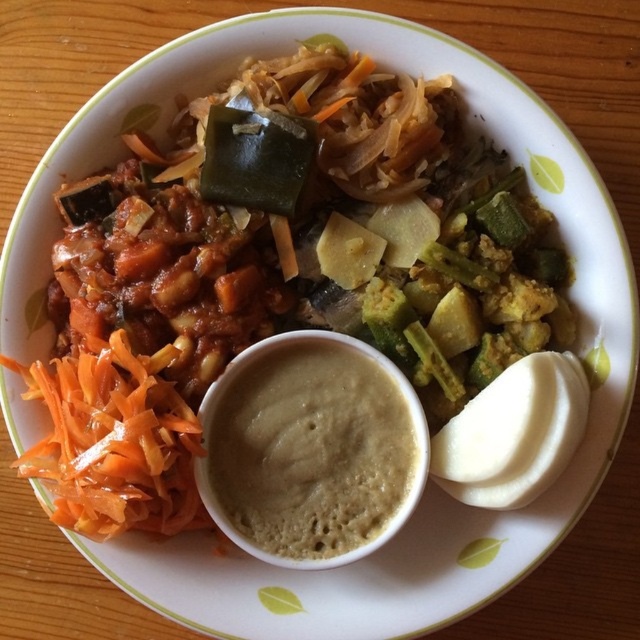
Question: Among these objects, which one is nearest to the camera?

Choices:
 (A) orange shredded carrot at lower left
 (B) smooth beige dip at center

Answer: (A)

Question: From the image, what is the correct spatial relationship of smooth beige dip at center in relation to orange shredded carrot at lower left?

Choices:
 (A) right
 (B) left

Answer: (A)

Question: Can you confirm if smooth beige dip at center is bigger than orange shredded carrot at lower left?

Choices:
 (A) yes
 (B) no

Answer: (B)

Question: Can you confirm if smooth beige dip at center is bigger than orange shredded carrot at lower left?

Choices:
 (A) no
 (B) yes

Answer: (A)

Question: Which of the following is the farthest from the observer?

Choices:
 (A) pos(173,461)
 (B) pos(401,476)

Answer: (B)